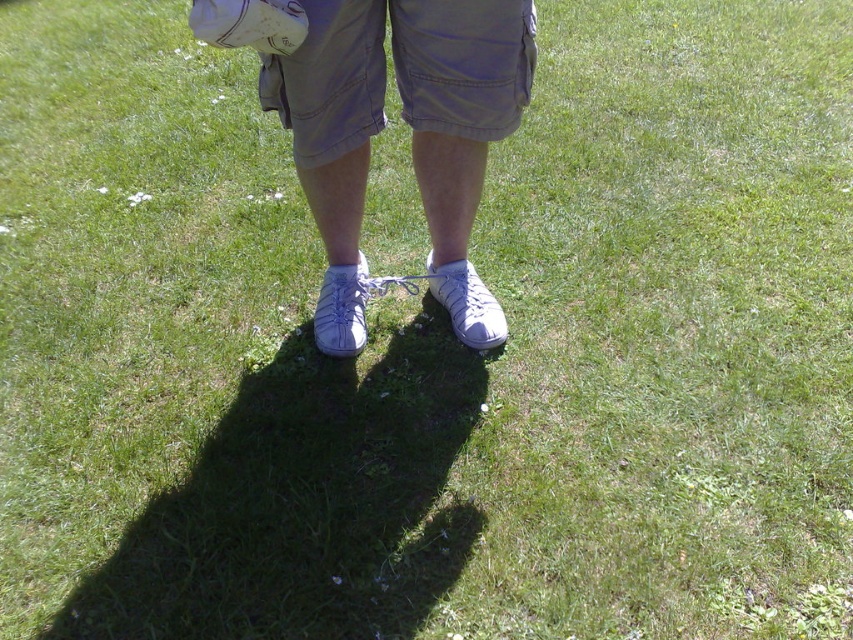
You are a photographer trying to capture the shadow of the person in the image. Since the sun is behind you, you notice the white leather sneakers at center and khaki cotton shorts at center. Which object is positioned to the left of the other when looking at their shadows?

The white leather sneakers at center is to the left of khaki cotton shorts at center, so their shadow will also be positioned to the left of the khaki cotton shorts at center.

You are a photographer trying to capture the shadow of the person standing on the grassy field. To ensure the shadow is fully visible in the photo, you need to position yourself so that the white leather sneakers at center are within your camera frame. Based on the coordinates provided, where should you position the camera relative to the sneakers?

The white leather sneakers at center are located at coordinates point (383, 125). To capture their shadow clearly, position the camera directly above or slightly behind the sneakers to ensure the shadow extends fully into the frame without obstruction.